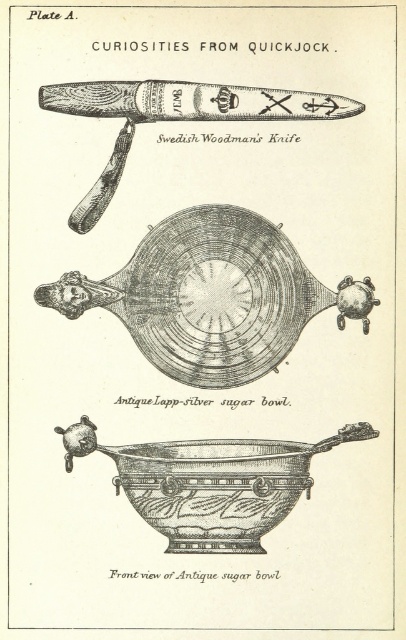
Question: Does black polished silver bowl at center have a larger size compared to matte wood swedish woodman's knife at upper center?

Choices:
 (A) no
 (B) yes

Answer: (B)

Question: Which object appears closest to the camera in this image?

Choices:
 (A) black polished silver bowl at center
 (B) antique silver sugar bowl at center

Answer: (B)

Question: Which point appears closest to the camera in this image?

Choices:
 (A) (289, 120)
 (B) (254, 230)

Answer: (A)

Question: Which point appears closest to the camera in this image?

Choices:
 (A) (168, 467)
 (B) (213, 113)
 (C) (99, 284)

Answer: (A)

Question: Is antique silver sugar bowl at center wider than matte wood swedish woodman's knife at upper center?

Choices:
 (A) yes
 (B) no

Answer: (B)

Question: Does antique silver sugar bowl at center appear on the left side of matte wood swedish woodman's knife at upper center?

Choices:
 (A) no
 (B) yes

Answer: (A)